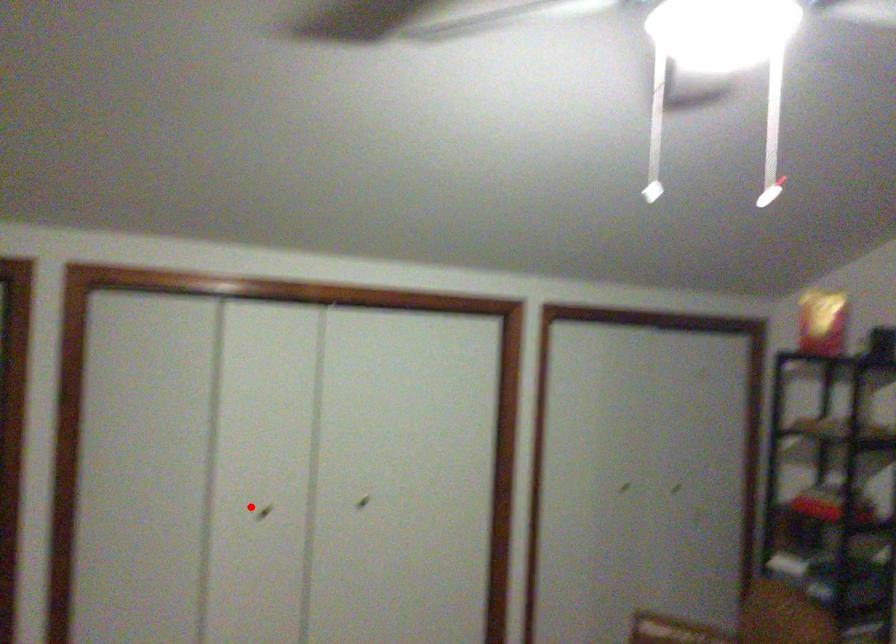
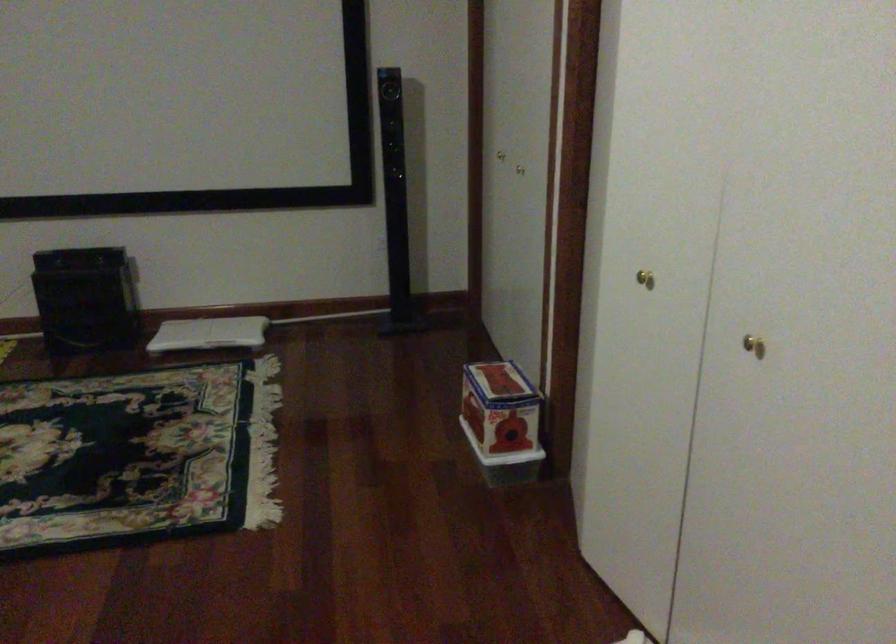
Question: I am providing you with two images of the same scene from different viewpoints. Given a red point in image1, look at the same physical point in image2. Is it:

Choices:
 (A) Closer to the viewpoint
 (B) Farther from the viewpoint

Answer: (A)